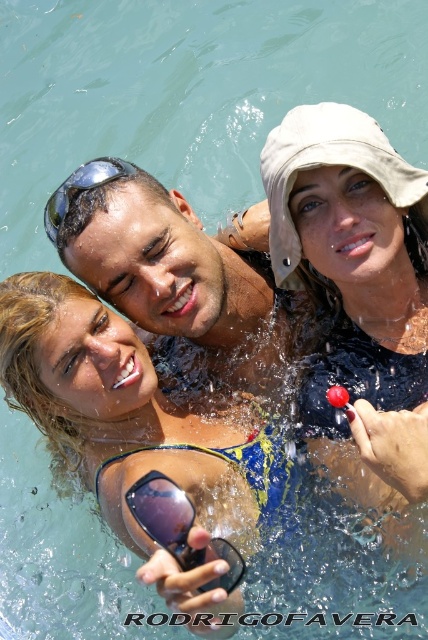
Does matte beige hat at upper right have a smaller size compared to matte black goggles at upper left?

Actually, matte beige hat at upper right might be larger than matte black goggles at upper left.

Is point (284, 241) closer to viewer compared to point (109, 180)?

That is True.

Is point (422, 225) farther from camera compared to point (59, 204)?

Yes, it is.

I want to click on matte beige hat at upper right, so click(x=356, y=296).

Can you confirm if matte beige hat at upper right is thinner than matte skin at center?

Yes, matte beige hat at upper right is thinner than matte skin at center.

Is matte beige hat at upper right positioned behind matte skin at center?

No, it is in front of matte skin at center.

Does point (347, 115) come in front of point (249, 244)?

Yes, point (347, 115) is closer to viewer.

Image resolution: width=428 pixels, height=640 pixels. Find the location of `matte beige hat at upper right`. matte beige hat at upper right is located at coordinates [356, 296].

Does matte black goggles at center have a greater width compared to matte black goggles at upper left?

Yes.

Does point (165, 476) come behind point (53, 202)?

No.

Where is `matte black goggles at center`? The width and height of the screenshot is (428, 640). matte black goggles at center is located at coordinates (180, 529).